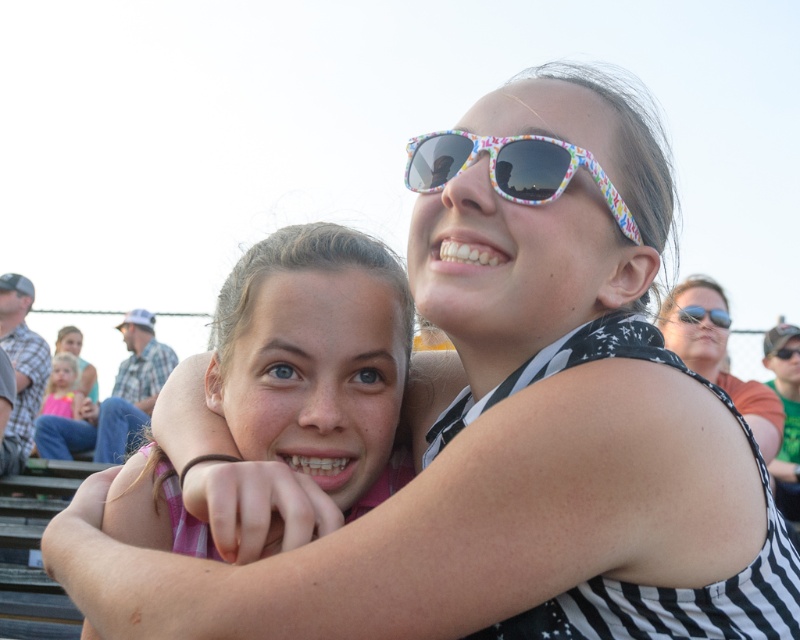
Question: Which point is farther to the camera?

Choices:
 (A) matte black sunglasses at upper center
 (B) pink fabric at center
 (C) colorful plastic sunglasses at upper center

Answer: (A)

Question: Among these points, which one is farthest from the camera?

Choices:
 (A) click(x=688, y=307)
 (B) click(x=541, y=172)
 (C) click(x=794, y=349)

Answer: (C)

Question: Can you confirm if pink fabric at center is positioned above colorful plastic sunglasses at upper center?

Choices:
 (A) yes
 (B) no

Answer: (B)

Question: Is black and white striped shirt at upper right wider than matte black sunglasses at upper center?

Choices:
 (A) yes
 (B) no

Answer: (A)

Question: Observing the image, what is the correct spatial positioning of pink fabric at center in reference to black and white striped shirt at upper right?

Choices:
 (A) right
 (B) left

Answer: (B)

Question: Estimate the real-world distances between objects in this image. Which object is closer to the pink fabric at center?

Choices:
 (A) multicolored plastic sunglasses at upper right
 (B) matte black sunglasses at upper center
 (C) colorful plastic sunglasses at upper center
 (D) black and white striped shirt at upper right

Answer: (C)